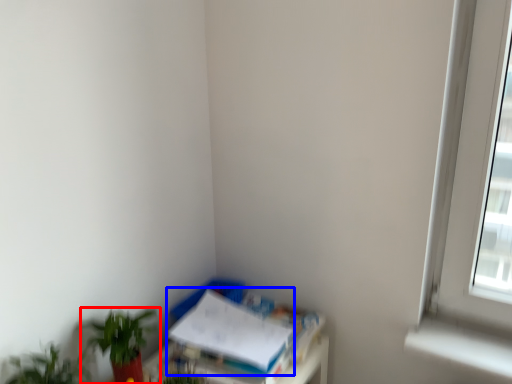
Question: Which point is closer to the camera, houseplant (highlighted by a red box) or paperback book (highlighted by a blue box)?

Choices:
 (A) houseplant
 (B) paperback book

Answer: (A)